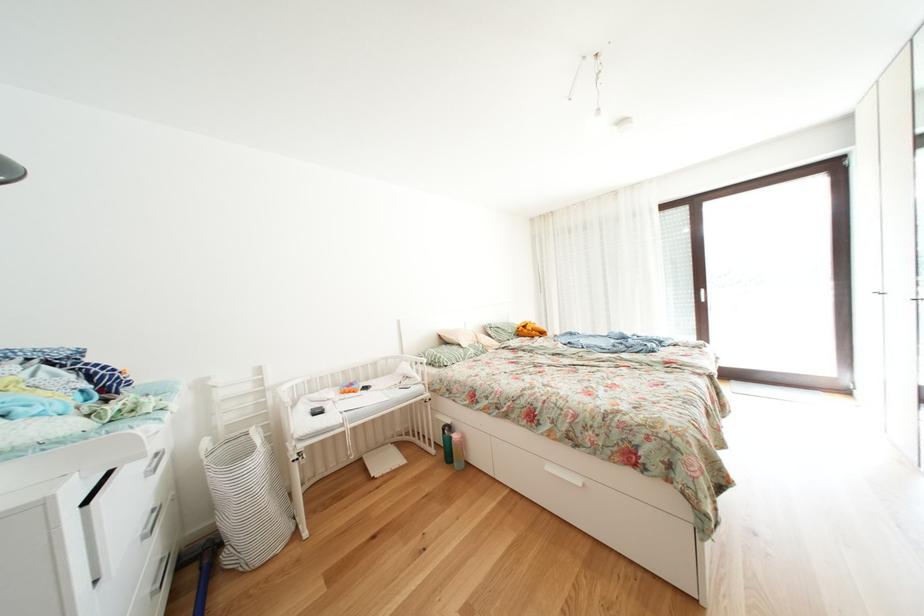
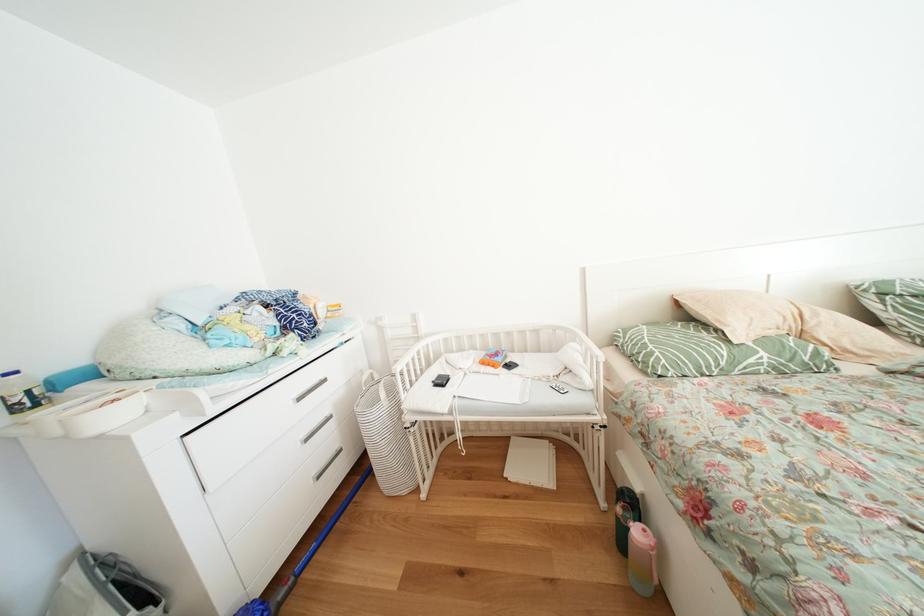
Where in the second image is the point corresponding to the point at 347,392 from the first image?

(491, 360)